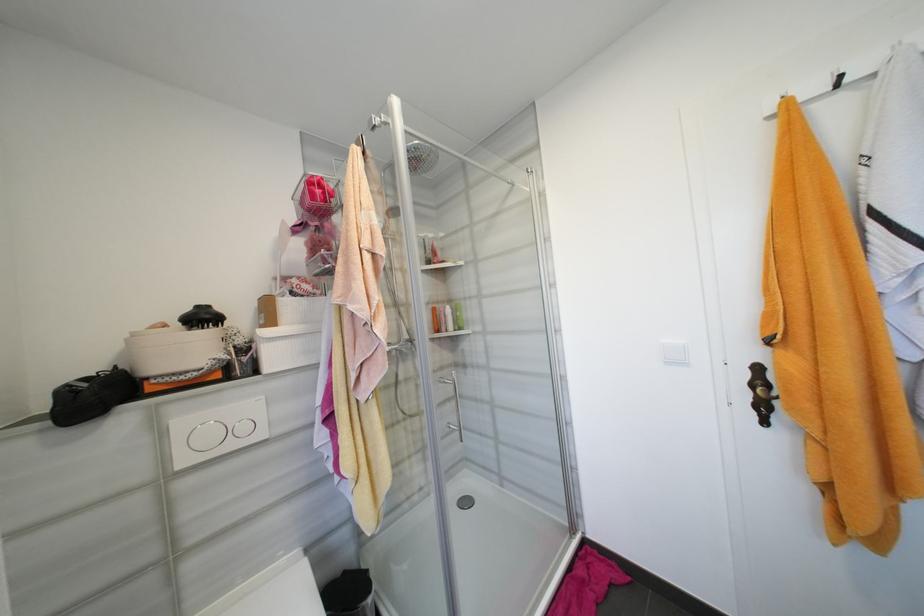
Where would you push the large flush button? Please return your answer as a coordinate pair (x, y).

(200, 436)